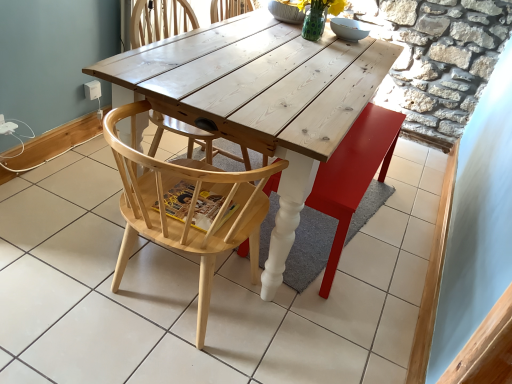
Locate an element on the screen. Image resolution: width=512 pixels, height=384 pixels. free spot to the right of wooden swivel chair at center is located at coordinates (400, 218).